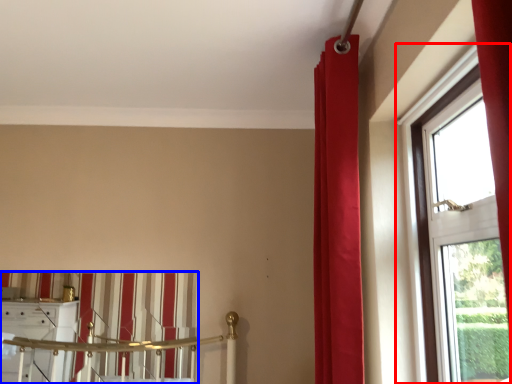
Question: Which object appears farthest to the camera in this image, window (highlighted by a red box) or curtain (highlighted by a blue box)?

Choices:
 (A) window
 (B) curtain

Answer: (B)